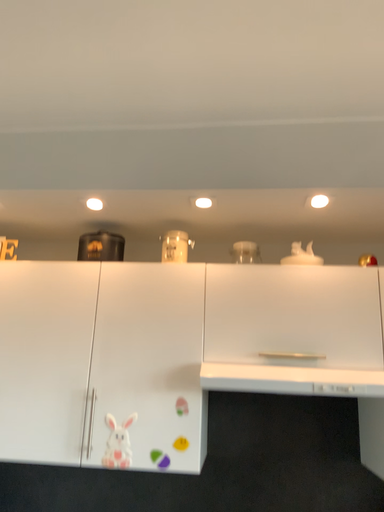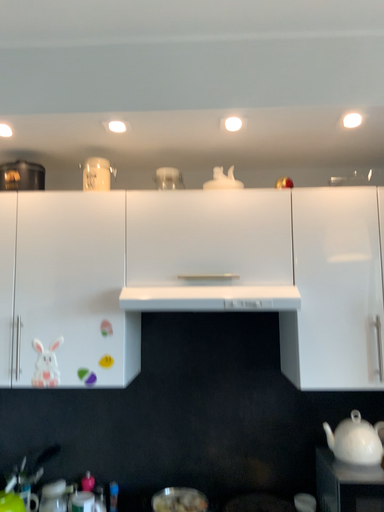
Question: Which way did the camera rotate in the video?

Choices:
 (A) rotated downward
 (B) rotated upward

Answer: (A)